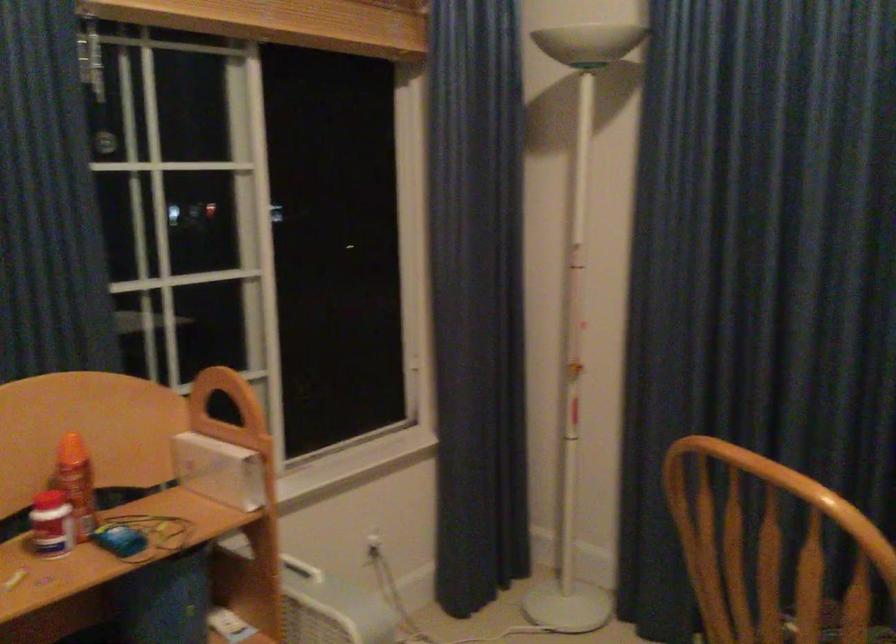
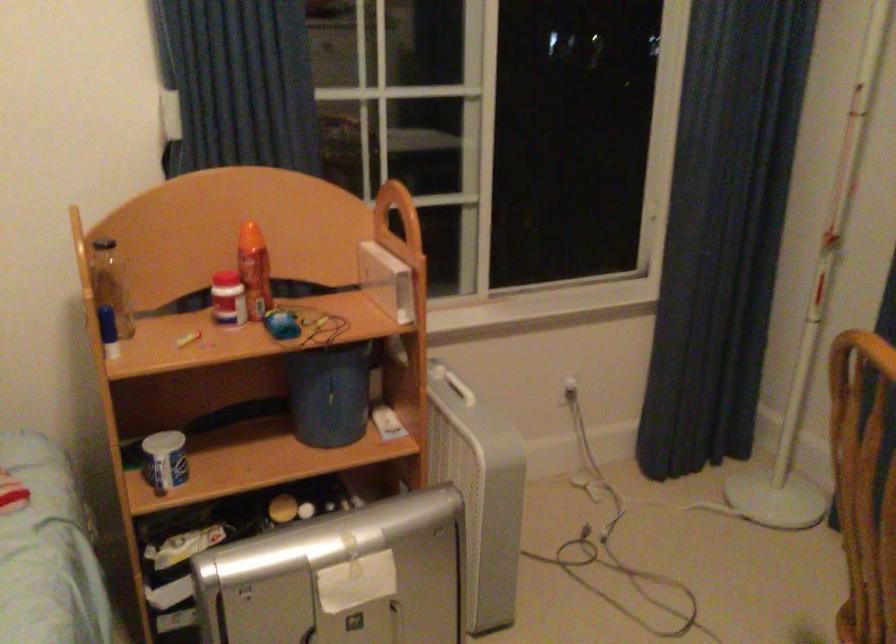
The point at (367,552) is marked in the first image. Where is the corresponding point in the second image?

(564, 392)